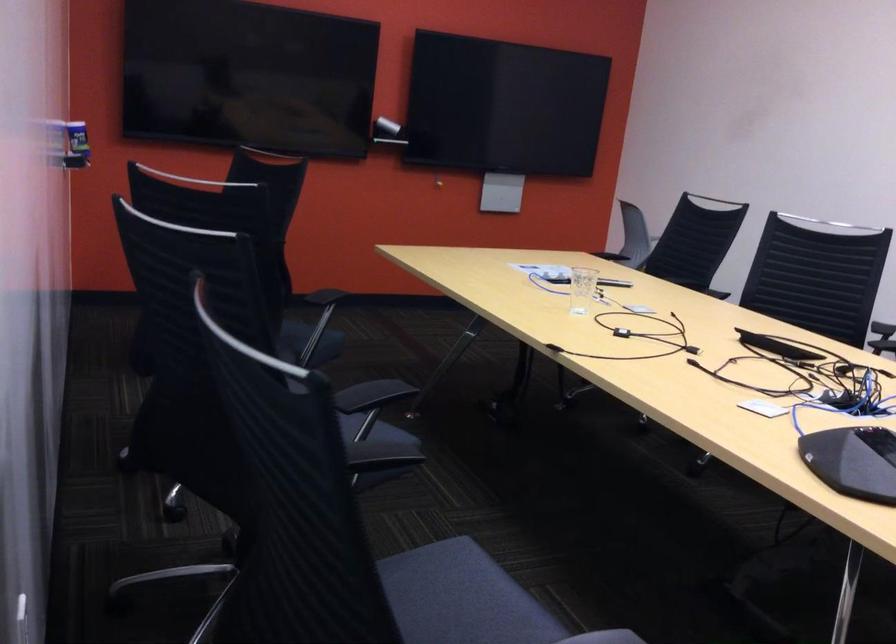
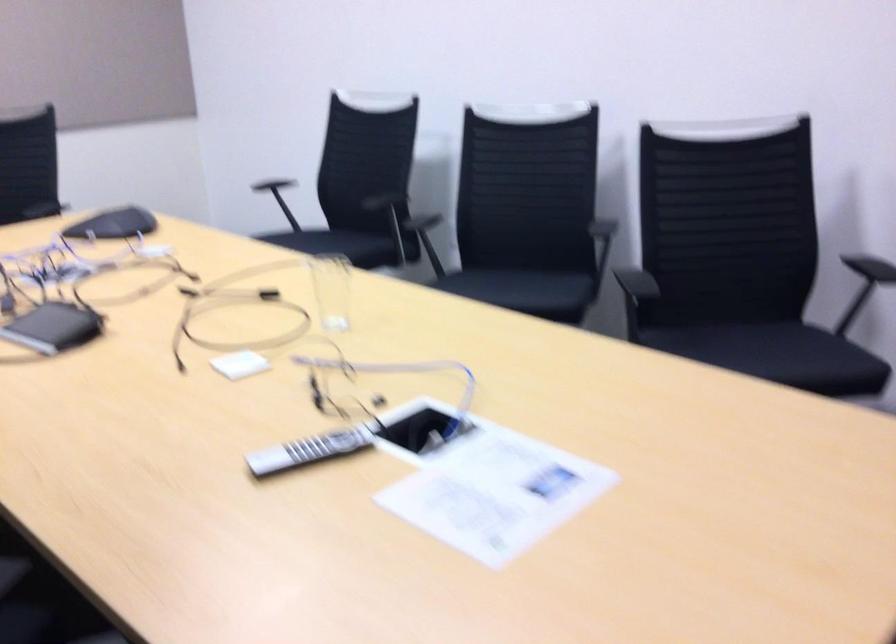
Question: I am providing you with two images of the same scene from different viewpoints. Which of the following objects are not visible in image2?

Choices:
 (A) pink air hockey mallet
 (B) black electronic device
 (C) black chair armrest
 (D) clear glass cup

Answer: (C)